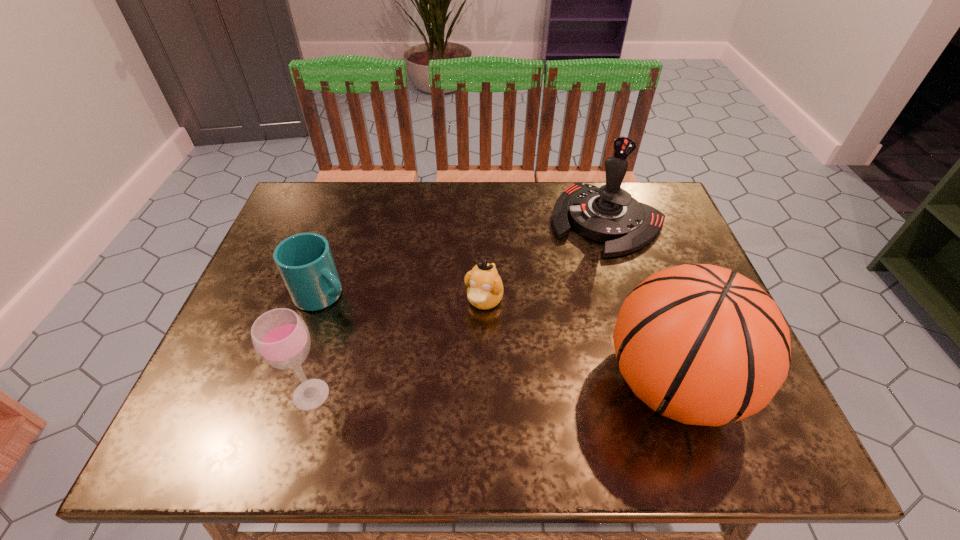
The height and width of the screenshot is (540, 960). I want to click on vacant space on the desktop that is between the wineglass and the basketball and is positioned on the handle side of the joystick, so click(x=473, y=390).

The width and height of the screenshot is (960, 540). Find the location of `vacant spot on the desktop that is between the wineglass and the basketball and is positioned on the handle side of the cup`. vacant spot on the desktop that is between the wineglass and the basketball and is positioned on the handle side of the cup is located at coordinates [487, 389].

Image resolution: width=960 pixels, height=540 pixels. I want to click on free spot on the desktop that is between the wineglass and the basketball and is positioned on the face of the duckling, so click(441, 390).